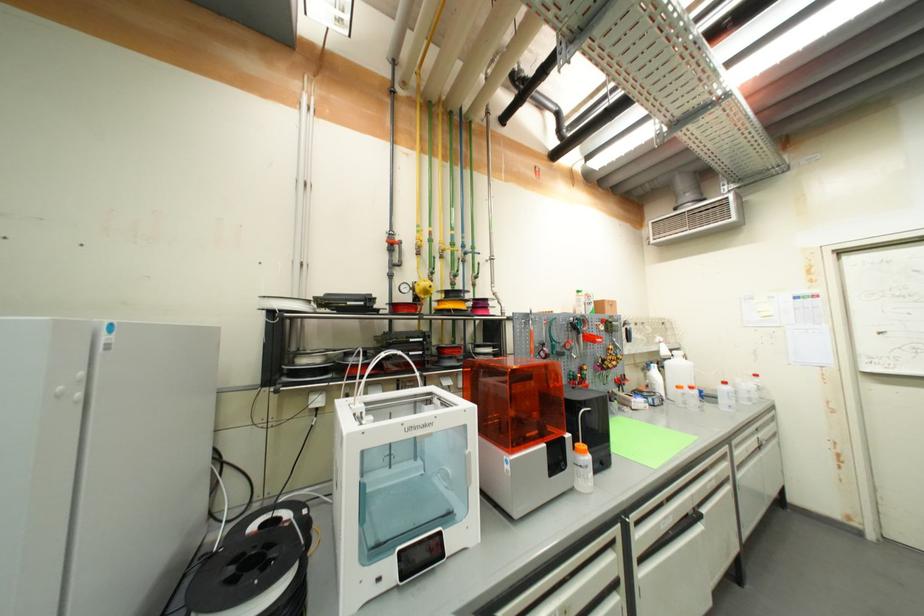
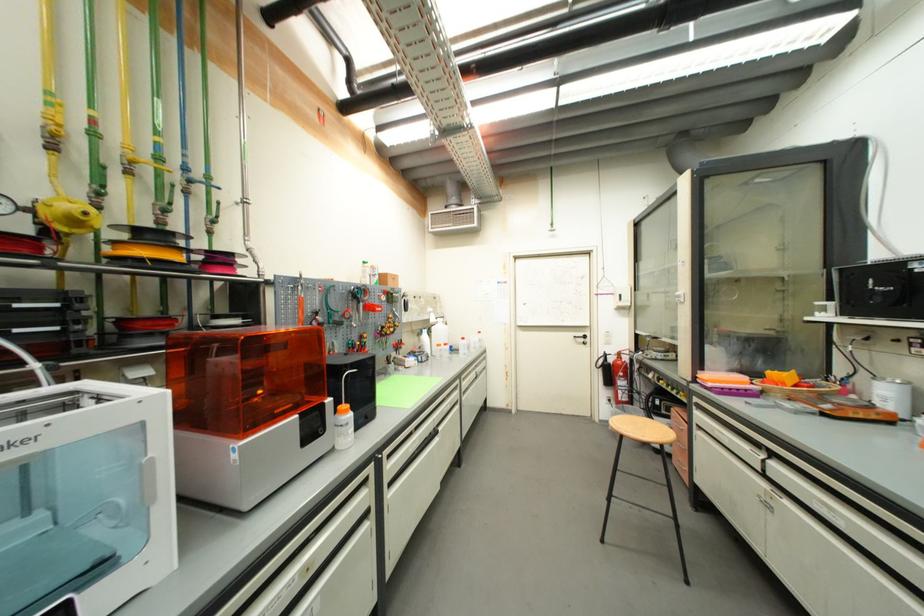
In the second image, find the point that corresponds to [423,233] in the first image.

(55, 106)